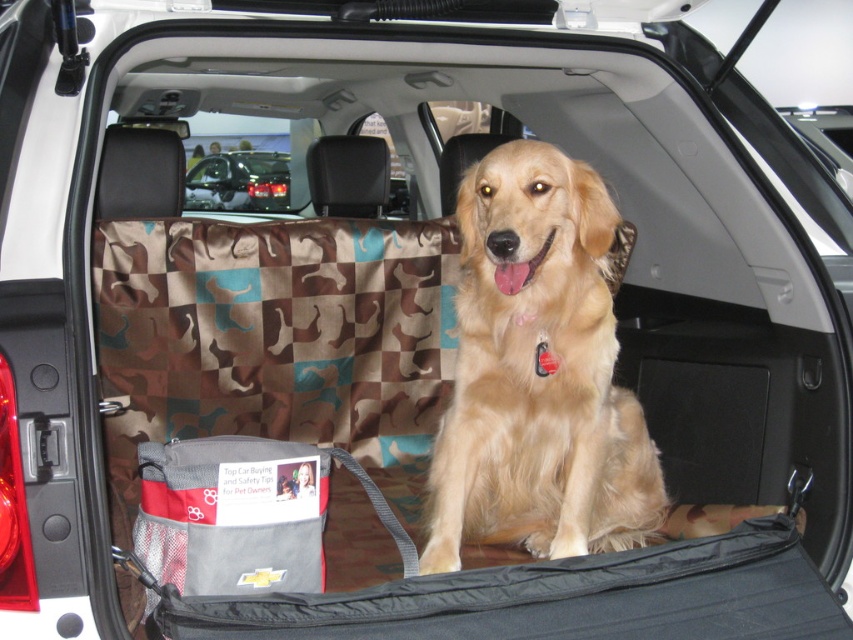
Question: Among these objects, which one is farthest from the camera?

Choices:
 (A) shiny black car at center
 (B) golden fur dog at center

Answer: (A)

Question: Can you confirm if golden fur dog at center is bigger than shiny black car at center?

Choices:
 (A) no
 (B) yes

Answer: (B)

Question: Is golden fur dog at center to the right of shiny black car at center from the viewer's perspective?

Choices:
 (A) yes
 (B) no

Answer: (A)

Question: Which point is closer to the camera?

Choices:
 (A) golden fur dog at center
 (B) shiny black car at center

Answer: (A)

Question: Which object appears farthest from the camera in this image?

Choices:
 (A) shiny black car at center
 (B) golden fur dog at center

Answer: (A)

Question: Is golden fur dog at center smaller than shiny black car at center?

Choices:
 (A) no
 (B) yes

Answer: (A)